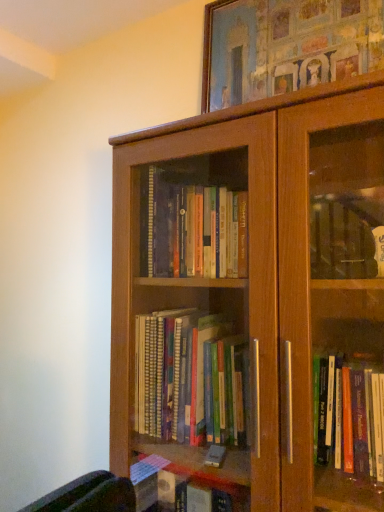
Question: Considering the relative sizes of brown wood bookcase at center and wooden picture frame at upper center in the image provided, is brown wood bookcase at center thinner than wooden picture frame at upper center?

Choices:
 (A) no
 (B) yes

Answer: (A)

Question: Is brown wood bookcase at center looking in the opposite direction of wooden picture frame at upper center?

Choices:
 (A) yes
 (B) no

Answer: (B)

Question: Does brown wood bookcase at center have a lesser height compared to wooden picture frame at upper center?

Choices:
 (A) no
 (B) yes

Answer: (A)

Question: Considering the relative sizes of brown wood bookcase at center and wooden picture frame at upper center in the image provided, is brown wood bookcase at center wider than wooden picture frame at upper center?

Choices:
 (A) no
 (B) yes

Answer: (B)

Question: From the image's perspective, is brown wood bookcase at center located above wooden picture frame at upper center?

Choices:
 (A) yes
 (B) no

Answer: (B)

Question: Would you say brown wood bookcase at center is outside wooden picture frame at upper center?

Choices:
 (A) yes
 (B) no

Answer: (A)

Question: From the image's perspective, is wooden picture frame at upper center located beneath brown wood bookcase at center?

Choices:
 (A) no
 (B) yes

Answer: (A)

Question: Is wooden picture frame at upper center further to the viewer compared to brown wood bookcase at center?

Choices:
 (A) no
 (B) yes

Answer: (B)

Question: Considering the relative sizes of wooden picture frame at upper center and brown wood bookcase at center in the image provided, is wooden picture frame at upper center taller than brown wood bookcase at center?

Choices:
 (A) no
 (B) yes

Answer: (A)

Question: Is wooden picture frame at upper center oriented away from brown wood bookcase at center?

Choices:
 (A) yes
 (B) no

Answer: (B)

Question: Considering the relative sizes of wooden picture frame at upper center and brown wood bookcase at center in the image provided, is wooden picture frame at upper center shorter than brown wood bookcase at center?

Choices:
 (A) yes
 (B) no

Answer: (A)

Question: Can you confirm if wooden picture frame at upper center is bigger than brown wood bookcase at center?

Choices:
 (A) no
 (B) yes

Answer: (A)

Question: Visually, is wooden picture frame at upper center positioned to the left or to the right of brown wood bookcase at center?

Choices:
 (A) left
 (B) right

Answer: (B)